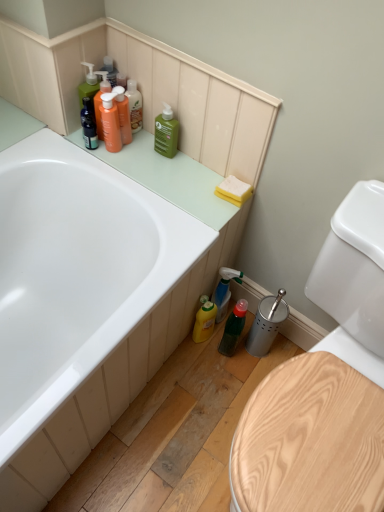
The width and height of the screenshot is (384, 512). Identify the location of free space on the front side of green matte bottle at upper center, which ranks as the third cleaning product in right-to-left order. (168, 182).